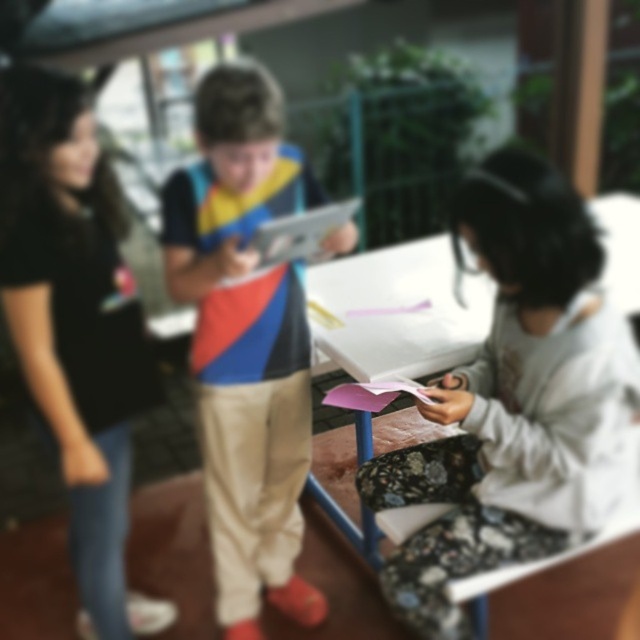
Question: Which of the following is the farthest from the observer?

Choices:
 (A) (253, 305)
 (B) (29, 100)
 (C) (442, 630)

Answer: (A)

Question: Which object appears farthest from the camera in this image?

Choices:
 (A) black matte shirt at left
 (B) matte plastic tablet at center

Answer: (B)

Question: Can you confirm if matte plastic tablet at center is positioned to the right of black matte shirt at left?

Choices:
 (A) yes
 (B) no

Answer: (A)

Question: Does fluffy white hoodie at lower right have a smaller size compared to matte plastic tablet at center?

Choices:
 (A) no
 (B) yes

Answer: (B)

Question: Which of the following is the closest to the observer?

Choices:
 (A) fluffy white hoodie at lower right
 (B) matte plastic tablet at center

Answer: (A)

Question: Does matte plastic tablet at center have a smaller size compared to black matte shirt at left?

Choices:
 (A) yes
 (B) no

Answer: (B)